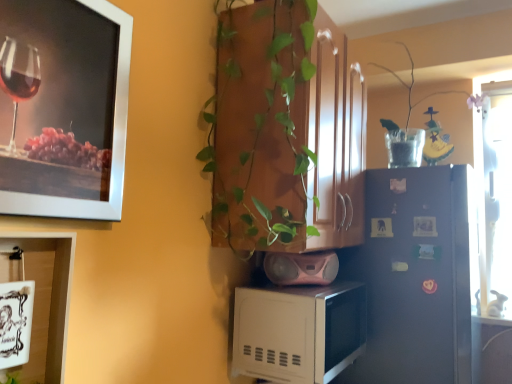
The image size is (512, 384). Identify the location of pink plastic speaker at lower center. (301, 268).

This screenshot has height=384, width=512. What do you see at coordinates (415, 276) in the screenshot?
I see `satin blue refrigerator at center right` at bounding box center [415, 276].

This screenshot has width=512, height=384. Describe the element at coordinates (63, 108) in the screenshot. I see `metallic silver picture frame at upper left, the 2th picture frame from the bottom` at that location.

You are a GUI agent. You are given a task and a screenshot of the screen. Output one action in this format:
    pyautogui.click(x=<x>, y=<y>)
    Task: Click on the green glossy plant at center
    This screenshot has width=512, height=384.
    Given the screenshot: What is the action you would take?
    pyautogui.click(x=284, y=132)

How many degrees apart are the facing directions of white matte microwave at lower center and green glossy plant at center?

There is a 0.834-degree angle between the facing directions of white matte microwave at lower center and green glossy plant at center.

Based on the photo, is white matte microwave at lower center behind green glossy plant at center?

Yes.

From a real-world perspective, which is physically below, white matte microwave at lower center or green glossy plant at center?

In real-world perspective, white matte microwave at lower center is lower.

Considering the points (293, 305) and (214, 110), which point is behind, point (293, 305) or point (214, 110)?

The point (214, 110) is farther from the camera.

Which is correct: pink plastic speaker at lower center is inside white matte microwave at lower center, or outside of it?

pink plastic speaker at lower center cannot be found inside white matte microwave at lower center.

Between pink plastic speaker at lower center and white matte microwave at lower center, which one has larger size?

white matte microwave at lower center.

Consider the image. Who is taller, pink plastic speaker at lower center or white matte microwave at lower center?

With more height is white matte microwave at lower center.

Is pink plastic speaker at lower center wider than white matte microwave at lower center?

Incorrect, the width of pink plastic speaker at lower center does not surpass that of white matte microwave at lower center.

Which object is positioned more to the left, metallic silver picture frame at upper left, the 2th picture frame from the bottom, or pink plastic speaker at lower center?

metallic silver picture frame at upper left, the 2th picture frame from the bottom.

Which is farther from the camera, (1,126) or (303,277)?

The point (303,277) is farther from the camera.

Are metallic silver picture frame at upper left, the 2th picture frame from the bottom, and pink plastic speaker at lower center located far from each other?

No.

Does metallic silver picture frame at upper left, arranged as the first picture frame when viewed from the top, come in front of pink plastic speaker at lower center?

Yes, metallic silver picture frame at upper left, arranged as the first picture frame when viewed from the top, is in front of pink plastic speaker at lower center.

Relative to satin blue refrigerator at center right, is green glossy plant at center in front or behind?

Visually, green glossy plant at center is located in front of satin blue refrigerator at center right.

Is point (229, 171) less distant than point (364, 250)?

Yes.

Considering the sizes of objects green glossy plant at center and satin blue refrigerator at center right in the image provided, who is thinner, green glossy plant at center or satin blue refrigerator at center right?

green glossy plant at center.

Is green glossy plant at center looking in the opposite direction of satin blue refrigerator at center right?

No.

Considering the sizes of objects clear glass vase at upper right and green glossy plant at center in the image provided, who is wider, clear glass vase at upper right or green glossy plant at center?

Wider between the two is green glossy plant at center.

Considering the sizes of objects clear glass vase at upper right and green glossy plant at center in the image provided, who is shorter, clear glass vase at upper right or green glossy plant at center?

clear glass vase at upper right is shorter.

From a real-world perspective, which is physically above, clear glass vase at upper right or green glossy plant at center?

clear glass vase at upper right.

Based on the photo, is clear glass vase at upper right looking in the opposite direction of green glossy plant at center?

That's not correct — clear glass vase at upper right is not looking away from green glossy plant at center.

Consider the image. Can you tell me how much white ceramic mug at lower left, positioned as the 2th picture frame in top-to-bottom order, and clear glass vase at upper right differ in facing direction?

They differ by 91 degrees in their facing directions.

Which object is wider, white ceramic mug at lower left, acting as the first picture frame starting from the bottom, or clear glass vase at upper right?

Wider between the two is clear glass vase at upper right.

Does white ceramic mug at lower left, acting as the first picture frame starting from the bottom, have a smaller size compared to clear glass vase at upper right?

Yes.

In the scene shown: Is white ceramic mug at lower left, acting as the first picture frame starting from the bottom, closer to camera compared to clear glass vase at upper right?

Yes, it is in front of clear glass vase at upper right.

From a real-world perspective, is green glossy plant at center positioned under pink plastic speaker at lower center based on gravity?

No.

Which is more to the right, green glossy plant at center or pink plastic speaker at lower center?

green glossy plant at center is more to the right.

Where is `houseplant in front of the pink plastic speaker at lower center`? This screenshot has width=512, height=384. houseplant in front of the pink plastic speaker at lower center is located at coordinates (284, 132).

Is point (312, 233) positioned in front of point (330, 253)?

Yes.

Image resolution: width=512 pixels, height=384 pixels. In order to click on microwave oven behind the green glossy plant at center in this screenshot , I will do `click(298, 332)`.

This screenshot has height=384, width=512. What are the coordinates of `microwave oven located in front of the pink plastic speaker at lower center` in the screenshot? It's located at (298, 332).

Which object lies nearer to the anchor point green glossy plant at center, clear glass vase at upper right or white ceramic mug at lower left, acting as the first picture frame starting from the bottom?

white ceramic mug at lower left, acting as the first picture frame starting from the bottom, is positioned closer to the anchor green glossy plant at center.

Based on the photo, when comparing their distances from clear glass vase at upper right, does green glossy plant at center or white ceramic mug at lower left, positioned as the 2th picture frame in top-to-bottom order, seem further?

Among the two, white ceramic mug at lower left, positioned as the 2th picture frame in top-to-bottom order, is located further to clear glass vase at upper right.

When comparing their distances from white ceramic mug at lower left, positioned as the 2th picture frame in top-to-bottom order, does white glossy cabinet at lower left or green glossy plant at center seem further?

green glossy plant at center.

Estimate the real-world distances between objects in this image. Which object is further from pink plastic speaker at lower center, white ceramic mug at lower left, positioned as the 2th picture frame in top-to-bottom order, or satin blue refrigerator at center right?

white ceramic mug at lower left, positioned as the 2th picture frame in top-to-bottom order, lies further to pink plastic speaker at lower center than the other object.

Looking at the image, which one is located closer to satin blue refrigerator at center right, metallic silver picture frame at upper left, arranged as the first picture frame when viewed from the top, or white ceramic mug at lower left, acting as the first picture frame starting from the bottom?

metallic silver picture frame at upper left, arranged as the first picture frame when viewed from the top, is positioned closer to the anchor satin blue refrigerator at center right.

When comparing their distances from pink plastic speaker at lower center, does white ceramic mug at lower left, acting as the first picture frame starting from the bottom, or clear glass vase at upper right seem closer?

The object closer to pink plastic speaker at lower center is white ceramic mug at lower left, acting as the first picture frame starting from the bottom.

When comparing their distances from white ceramic mug at lower left, positioned as the 2th picture frame in top-to-bottom order, does white glossy cabinet at lower left or pink plastic speaker at lower center seem further?

Among the two, pink plastic speaker at lower center is located further to white ceramic mug at lower left, positioned as the 2th picture frame in top-to-bottom order.

When comparing their distances from clear glass vase at upper right, does white glossy cabinet at lower left or pink plastic speaker at lower center seem further?

Based on the image, white glossy cabinet at lower left appears to be further to clear glass vase at upper right.

Identify the location of picture frame between white ceramic mug at lower left, acting as the first picture frame starting from the bottom, and clear glass vase at upper right from left to right. This screenshot has width=512, height=384. (63, 108).

This screenshot has height=384, width=512. What are the coordinates of `houseplant between white ceramic mug at lower left, positioned as the 2th picture frame in top-to-bottom order, and satin blue refrigerator at center right from left to right` in the screenshot? It's located at (284, 132).

Where is `microwave oven situated between white glossy cabinet at lower left and clear glass vase at upper right from left to right`? Image resolution: width=512 pixels, height=384 pixels. microwave oven situated between white glossy cabinet at lower left and clear glass vase at upper right from left to right is located at coordinates (298, 332).

The height and width of the screenshot is (384, 512). I want to click on microwave oven between clear glass vase at upper right and satin blue refrigerator at center right vertically, so click(x=298, y=332).